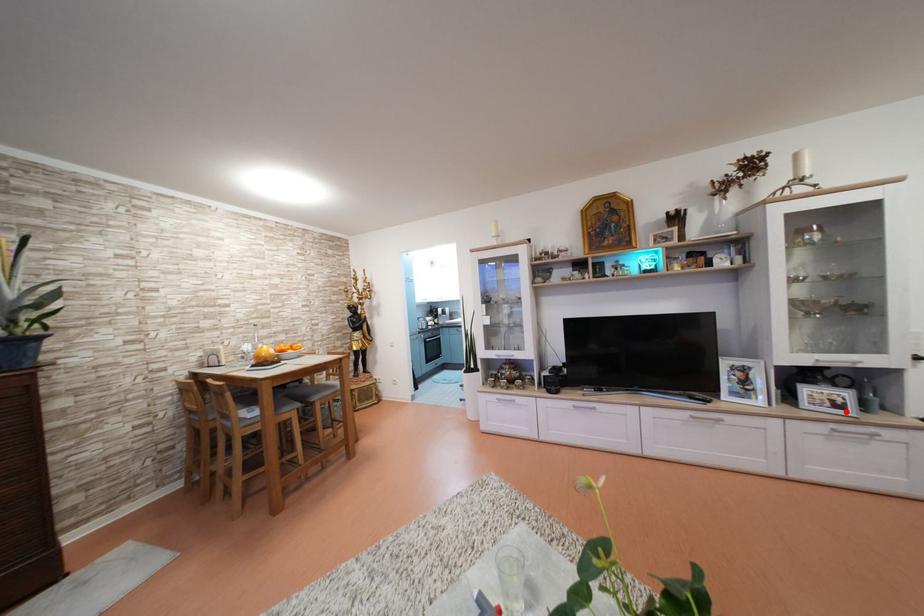
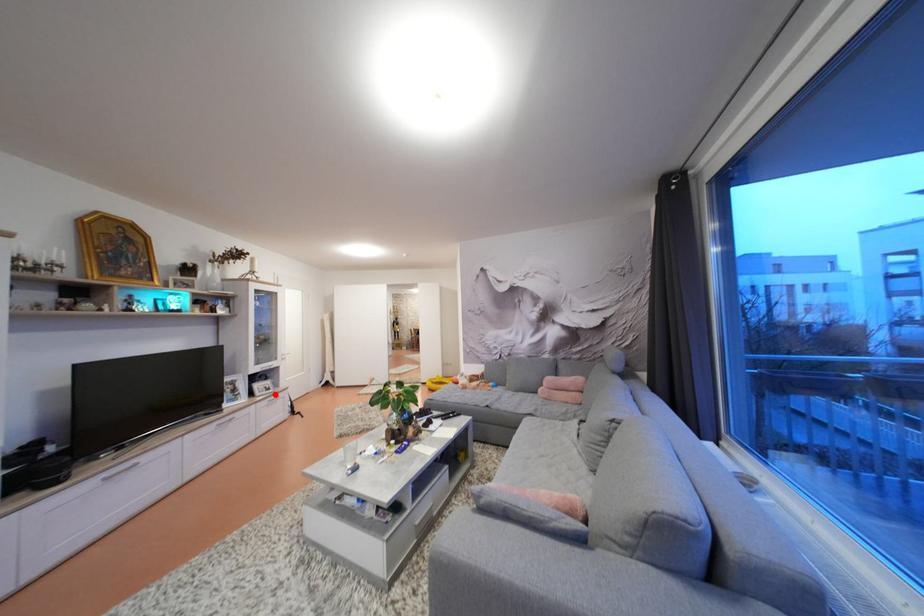
I am providing you with two images of the same scene from different viewpoints. A red point is marked on the first image and another point is marked on the second image. Is the red point in image1 aligned with the point shown in image2?

Yes